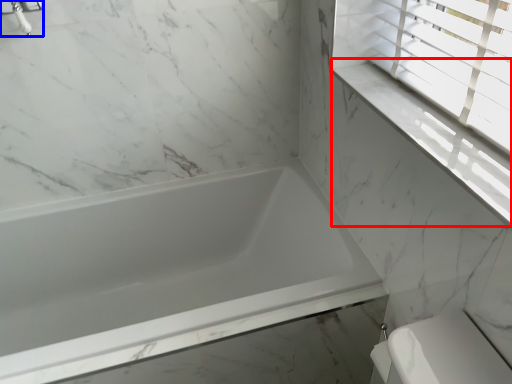
Question: Among these objects, which one is farthest to the camera, window sill (highlighted by a red box) or faucet (highlighted by a blue box)?

Choices:
 (A) window sill
 (B) faucet

Answer: (B)